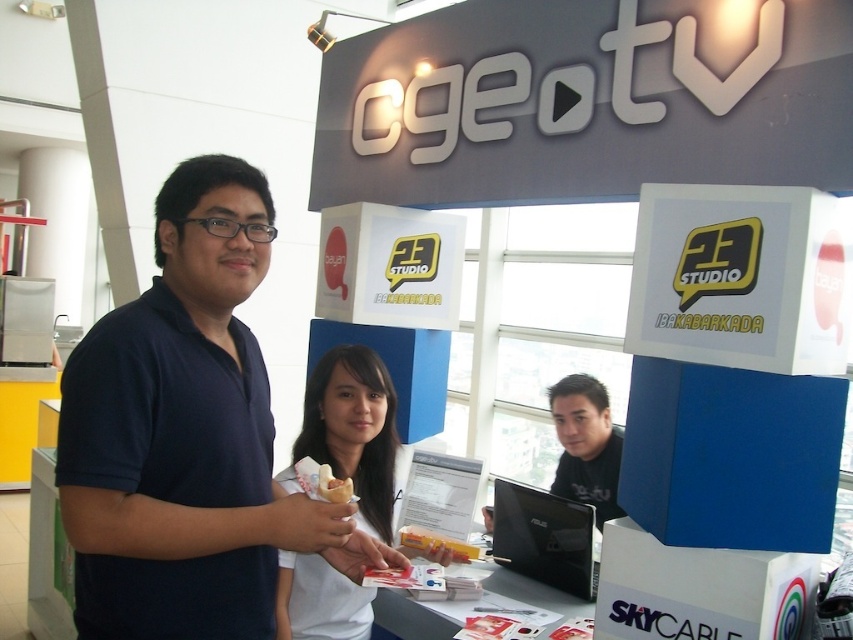
You are at the cgeoTV booth and want to find the dark blue polo shirt at center. Which coordinate should you look at?

You should look at coordinate point [183,433] to find the dark blue polo shirt at center.